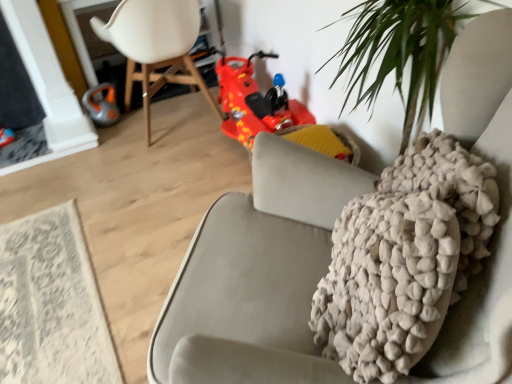
Locate an element on the screen. blank area beneath white plastic chair at upper left (from a real-world perspective) is located at coordinates coord(176,123).